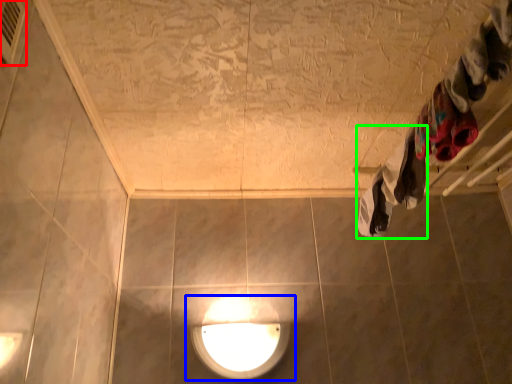
Question: Based on their relative distances, which object is farther from air conditioner (highlighted by a red box)? Choose from lamp (highlighted by a blue box) and clothing (highlighted by a green box).

Choices:
 (A) lamp
 (B) clothing

Answer: (A)